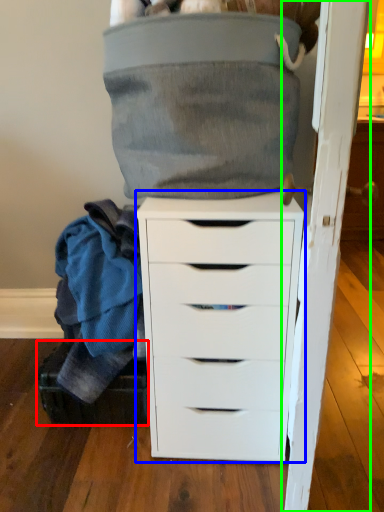
Question: Based on their relative distances, which object is farther from shoe box (highlighted by a red box)? Choose from chest of drawers (highlighted by a blue box) and door (highlighted by a green box).

Choices:
 (A) chest of drawers
 (B) door

Answer: (B)